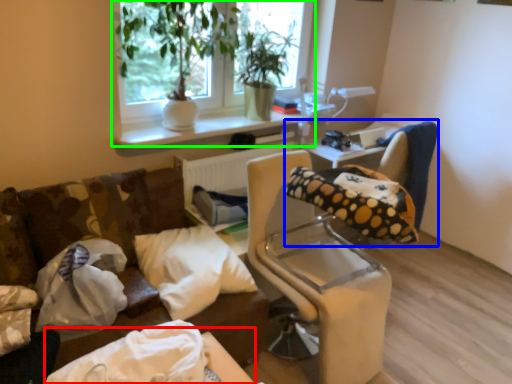
Question: Which object is the closest to the table (highlighted by a red box)? Choose among these: bean bag chair (highlighted by a blue box) or window (highlighted by a green box).

Choices:
 (A) bean bag chair
 (B) window

Answer: (A)